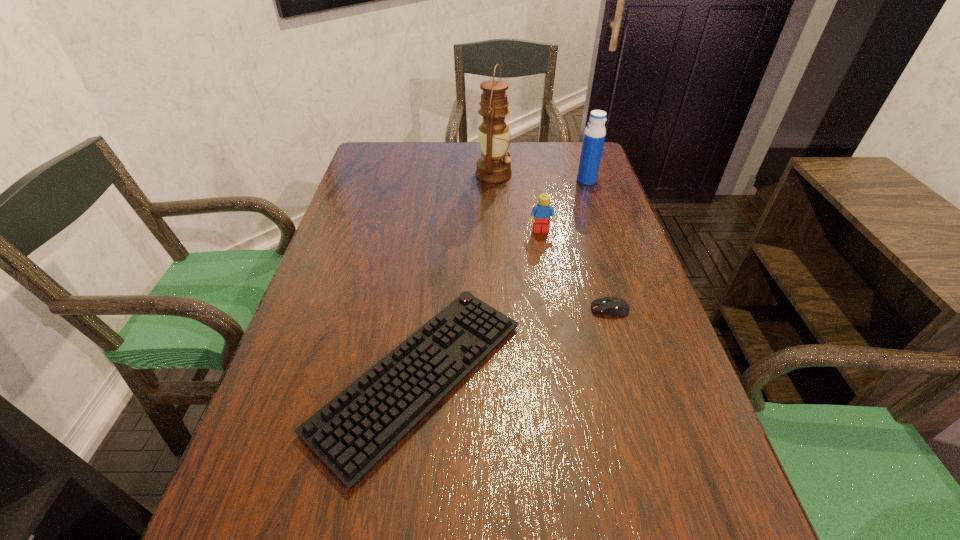
The width and height of the screenshot is (960, 540). Find the location of `free spot between the Lego and the fourth shortest object`. free spot between the Lego and the fourth shortest object is located at coordinates (564, 206).

You are a GUI agent. You are given a task and a screenshot of the screen. Output one action in this format:
    pyautogui.click(x=<x>, y=<y>)
    Task: Click on the vacant point located between the Lego and the second tallest object
    This screenshot has width=960, height=540.
    Given the screenshot: What is the action you would take?
    pyautogui.click(x=564, y=206)

Find the location of a particular element. The height and width of the screenshot is (540, 960). empty space that is in between the computer equipment and the oil lamp is located at coordinates (552, 242).

Identify which object is the closest to the computer equipment. Please provide its 2D coordinates. Your answer should be formatted as a tuple, i.e. [(x, y)], where the tuple contains the x and y coordinates of a point satisfying the conditions above.

[(352, 433)]

Identify which object is the fourth closest to the tallest object. Please provide its 2D coordinates. Your answer should be formatted as a tuple, i.e. [(x, y)], where the tuple contains the x and y coordinates of a point satisfying the conditions above.

[(614, 306)]

The width and height of the screenshot is (960, 540). I want to click on vacant area in the image that satisfies the following two spatial constraints: 1. on the front side of the water bottle; 2. on the button of the computer equipment, so click(x=630, y=309).

Locate an element on the screen. The image size is (960, 540). vacant area that satisfies the following two spatial constraints: 1. on the button of the computer equipment; 2. on the front side of the computer keyboard is located at coordinates (630, 377).

Image resolution: width=960 pixels, height=540 pixels. Identify the location of free point that satisfies the following two spatial constraints: 1. on the front side of the tallest object; 2. on the right side of the water bottle. (493, 181).

Locate an element on the screen. The height and width of the screenshot is (540, 960). free space that satisfies the following two spatial constraints: 1. on the back side of the computer keyboard; 2. on the left side of the water bottle is located at coordinates (443, 181).

This screenshot has height=540, width=960. Identify the location of vacant space that satisfies the following two spatial constraints: 1. on the back side of the tallest object; 2. on the left side of the computer keyboard. (444, 174).